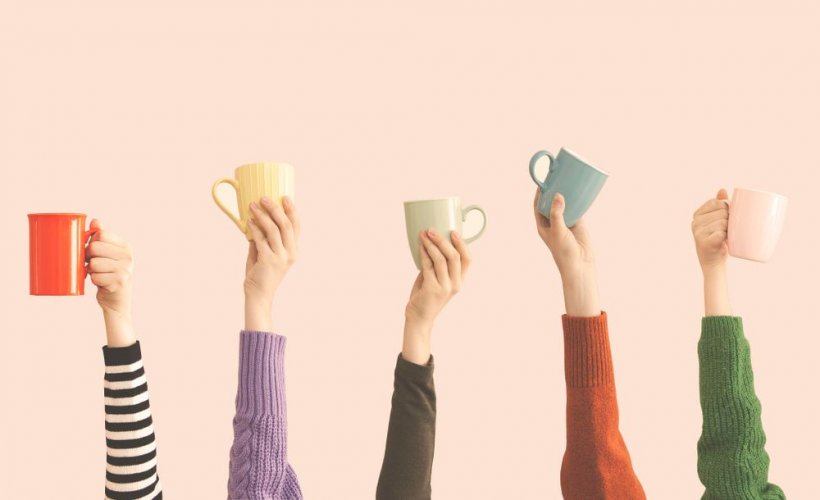
You are a GUI agent. You are given a task and a screenshot of the screen. Output one action in this format:
    pyautogui.click(x=<x>, y=<y>)
    Task: Click on the mugs
    The image size is (820, 500).
    Given the screenshot: What is the action you would take?
    click(64, 271), click(254, 193), click(433, 225), click(599, 170), click(761, 216)